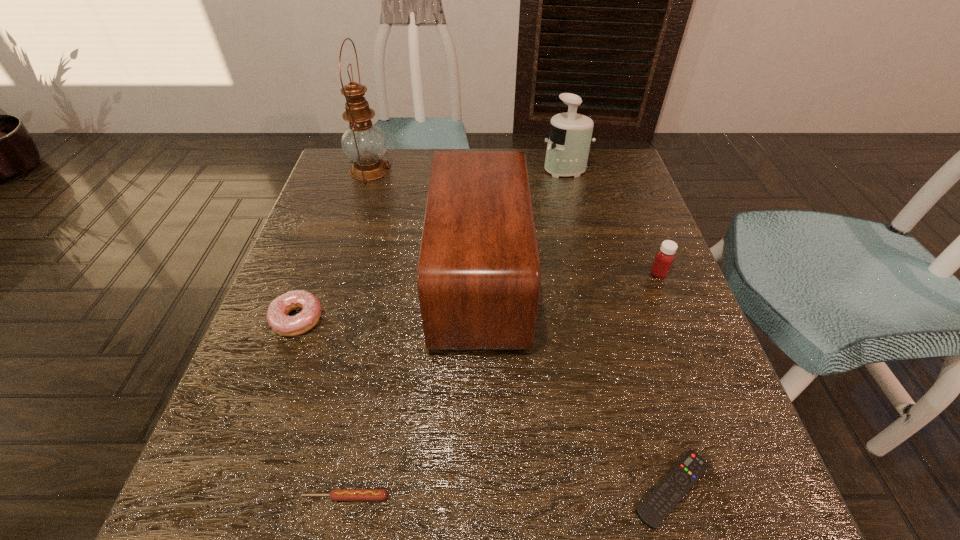
Image resolution: width=960 pixels, height=540 pixels. What are the coordinates of `the tallest object` in the screenshot? It's located at (364, 143).

Locate an element on the screen. The height and width of the screenshot is (540, 960). juicer is located at coordinates (570, 135).

You are a GUI agent. You are given a task and a screenshot of the screen. Output one action in this format:
    pyautogui.click(x=<x>, y=<y>)
    Task: Click on the radio receiver
    The image size is (960, 540).
    Given the screenshot: What is the action you would take?
    pyautogui.click(x=479, y=278)

At what (x,y) coordinates should I click in order to perform the action: click on the fourth shortest object. Please return your answer as a coordinate pair (x, y). Looking at the image, I should click on (664, 258).

This screenshot has height=540, width=960. Identify the location of medicine. (664, 258).

This screenshot has height=540, width=960. Identify the location of the fifth tallest object. (307, 318).

Where is `the second shortest object`? This screenshot has height=540, width=960. the second shortest object is located at coordinates (336, 494).

Find the location of a particular element. The height and width of the screenshot is (540, 960). the shortest object is located at coordinates (666, 495).

You are a GUI agent. You are given a task and a screenshot of the screen. Output one action in this format:
    pyautogui.click(x=<x>, y=<y>)
    Task: Click on the free spot located 0.110m on the right of the tallest object
    
    Given the screenshot: What is the action you would take?
    pyautogui.click(x=430, y=170)

Where is `free space located on the front of the juicer`? free space located on the front of the juicer is located at coordinates (584, 244).